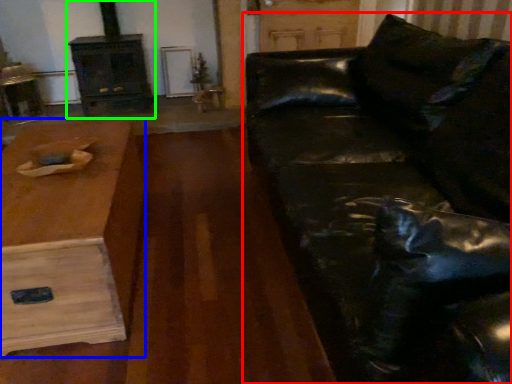
Question: Which is nearer to the studio couch (highlighted by a red box)? table (highlighted by a blue box) or fireplace (highlighted by a green box).

Choices:
 (A) table
 (B) fireplace

Answer: (A)